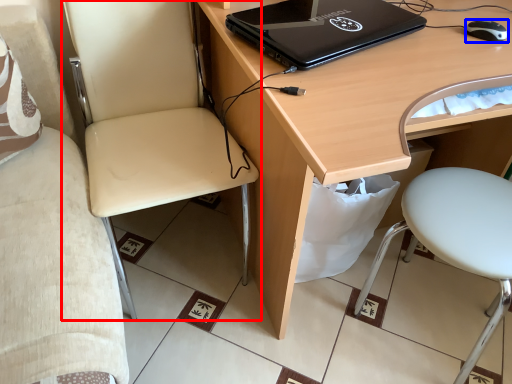
Question: Which object is closer to the camera taking this photo, chair (highlighted by a red box) or mouse (highlighted by a blue box)?

Choices:
 (A) chair
 (B) mouse

Answer: (A)